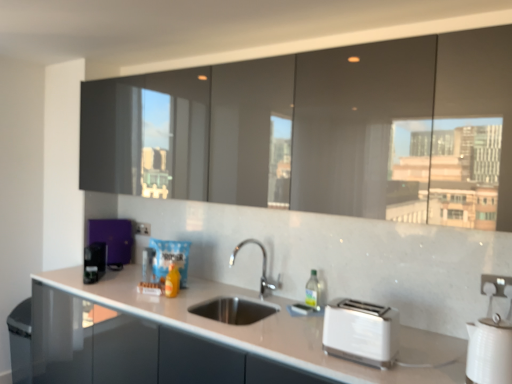
I want to click on vacant space to the left of translucent plastic bag at center, so click(x=131, y=288).